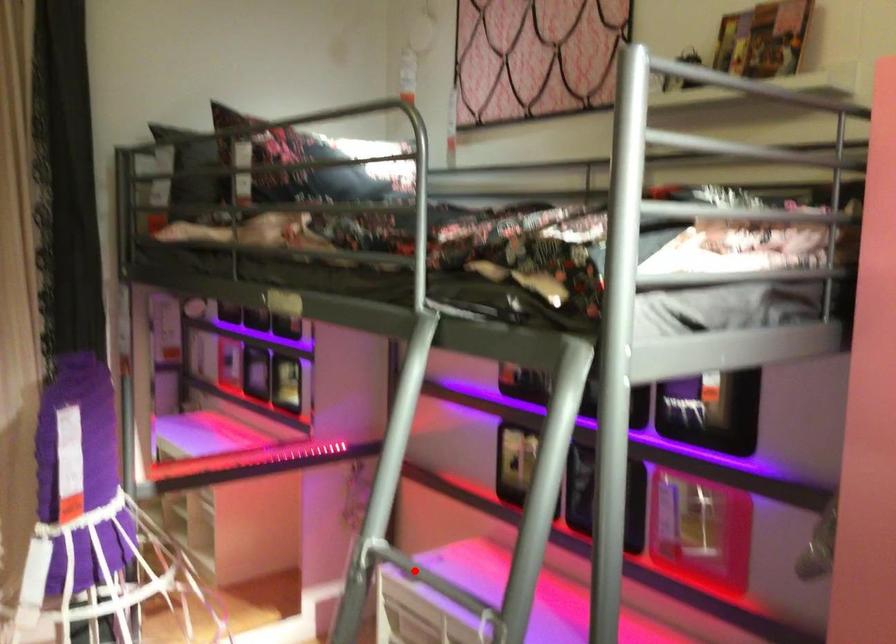
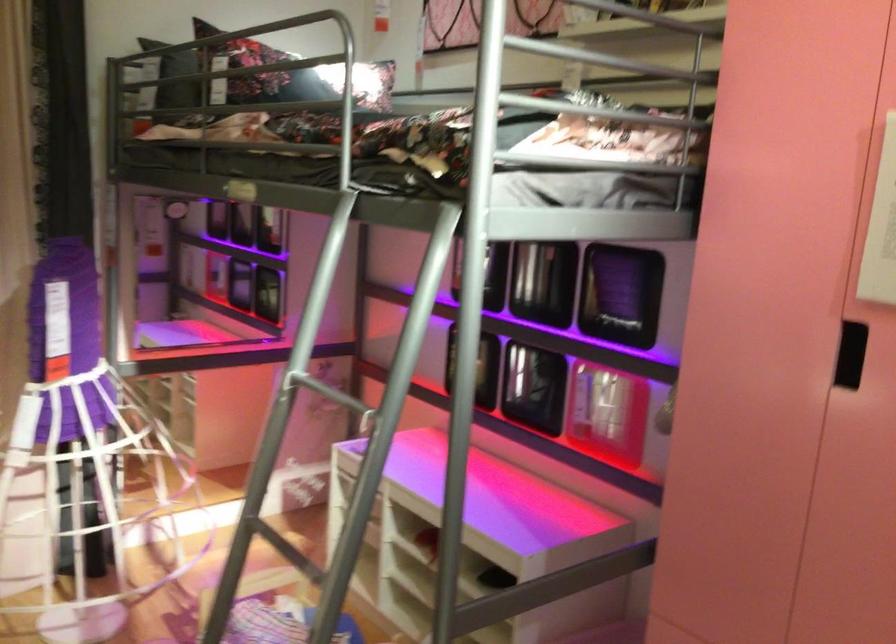
Find the pixel in the second image that matches the highlighted location in the first image.

(323, 391)